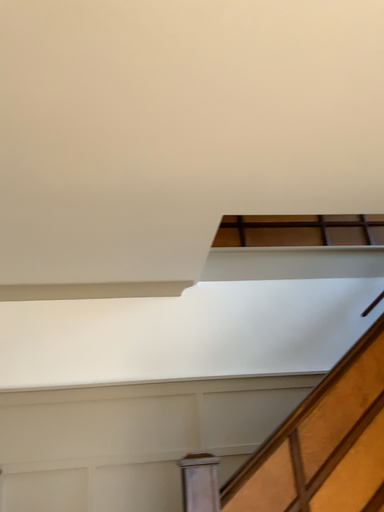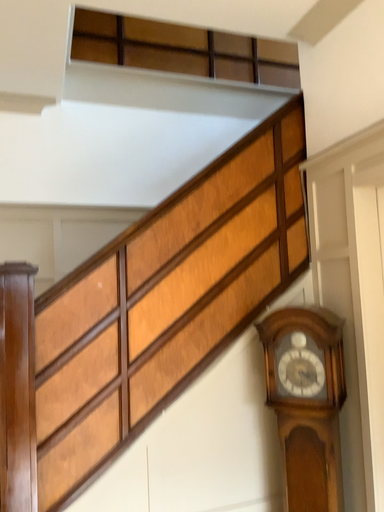
Question: Which way did the camera rotate in the video?

Choices:
 (A) rotated right
 (B) rotated left

Answer: (A)